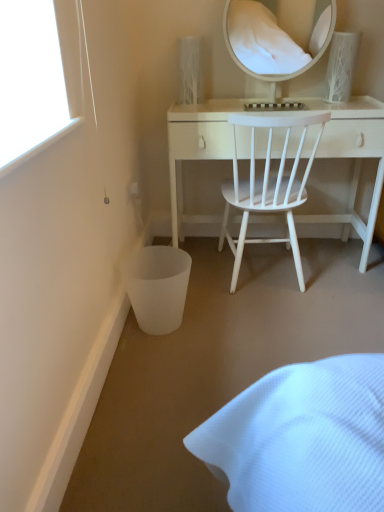
Question: Is white glossy mirror at upper center oriented away from white matte wood desk at center?

Choices:
 (A) yes
 (B) no

Answer: (B)

Question: From the image's perspective, is white glossy mirror at upper center beneath white matte wood desk at center?

Choices:
 (A) yes
 (B) no

Answer: (B)

Question: Considering the relative sizes of white glossy mirror at upper center and white matte wood desk at center in the image provided, is white glossy mirror at upper center taller than white matte wood desk at center?

Choices:
 (A) yes
 (B) no

Answer: (B)

Question: From a real-world perspective, is white glossy mirror at upper center positioned over white matte wood desk at center based on gravity?

Choices:
 (A) yes
 (B) no

Answer: (A)

Question: Does white glossy mirror at upper center lie in front of white matte wood desk at center?

Choices:
 (A) no
 (B) yes

Answer: (A)

Question: Considering the positions of white textured vase at upper right and white matte wood desk at center in the image, is white textured vase at upper right bigger or smaller than white matte wood desk at center?

Choices:
 (A) big
 (B) small

Answer: (B)

Question: From a real-world perspective, relative to white matte wood desk at center, is white textured vase at upper right vertically above or below?

Choices:
 (A) below
 (B) above

Answer: (B)

Question: Relative to white matte wood desk at center, is white textured vase at upper right in front or behind?

Choices:
 (A) front
 (B) behind

Answer: (B)

Question: Is white textured vase at upper right to the left or to the right of white matte wood desk at center in the image?

Choices:
 (A) left
 (B) right

Answer: (B)

Question: Looking at their shapes, would you say white glossy mirror at upper center is wider or thinner than white matte wood desk at center?

Choices:
 (A) thin
 (B) wide

Answer: (A)

Question: Is point 288,50 positioned closer to the camera than point 301,219?

Choices:
 (A) closer
 (B) farther

Answer: (B)

Question: Is white glossy mirror at upper center situated inside white matte wood desk at center or outside?

Choices:
 (A) outside
 (B) inside

Answer: (A)

Question: Is white glossy mirror at upper center to the left or to the right of white matte wood desk at center in the image?

Choices:
 (A) left
 (B) right

Answer: (A)

Question: Looking at their shapes, would you say white textured vase at upper right is wider or thinner than white glossy mirror at upper center?

Choices:
 (A) thin
 (B) wide

Answer: (B)

Question: Considering the positions of white textured vase at upper right and white glossy mirror at upper center in the image, is white textured vase at upper right taller or shorter than white glossy mirror at upper center?

Choices:
 (A) tall
 (B) short

Answer: (B)